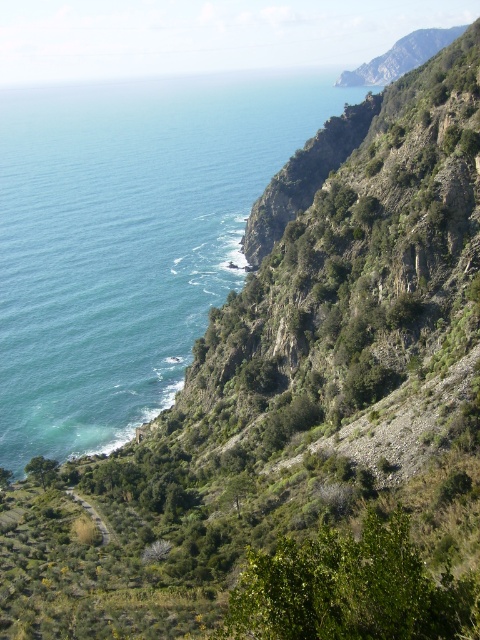
You are a hiker who wants to take a photo of the blue water at upper left and the green grassy path at lower left. Which object should you focus on first to ensure both are in the frame?

You should focus on the blue water at upper left first because it is larger than the green grassy path at lower left, so it will take up more space in the frame and ensure both are included.